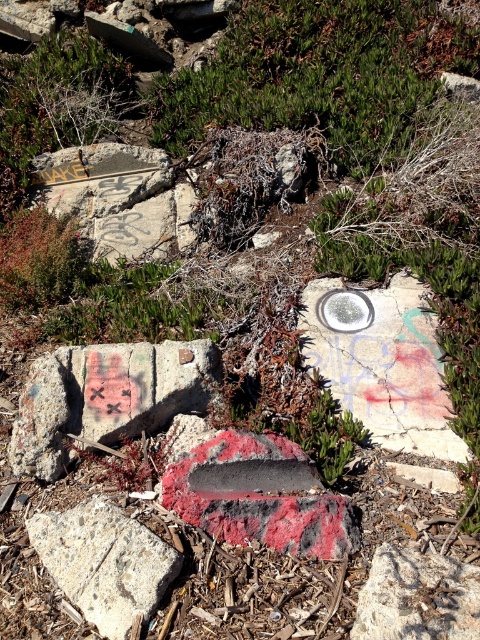
Does point (276, 480) come behind point (120, 522)?

Yes, point (276, 480) is farther from viewer.

Who is more distant from viewer, (323, 525) or (144, 582)?

Point (323, 525)

Locate an element on the screen. This screenshot has height=640, width=480. smooth red stone at center is located at coordinates click(259, 496).

Is painted concrete block at center positioned at the back of smooth gray rock at center?

Yes, it is.

Which is more to the left, painted concrete block at center or smooth gray rock at center?

From the viewer's perspective, painted concrete block at center appears more on the left side.

Between point (120, 404) and point (380, 577), which one is positioned in front?

Point (380, 577) is more forward.

Where is `painted concrete block at center`? painted concrete block at center is located at coordinates (106, 396).

From the picture: Is smooth concrete circle at center closer to the viewer compared to speckled concrete rock at lower left?

No, smooth concrete circle at center is behind speckled concrete rock at lower left.

Does smooth concrete circle at center appear under speckled concrete rock at lower left?

Actually, smooth concrete circle at center is above speckled concrete rock at lower left.

Does point (311, 280) lie in front of point (28, 534)?

No, (311, 280) is behind (28, 534).

Locate an element on the screen. The width and height of the screenshot is (480, 640). smooth concrete circle at center is located at coordinates (383, 362).